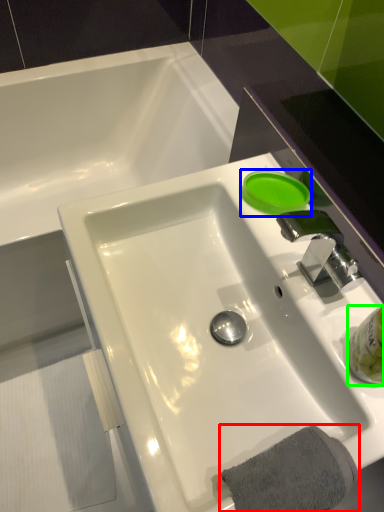
Question: Which is nearer to the bath towel (highlighted by a red box)? liquid (highlighted by a blue box) or liquid (highlighted by a green box).

Choices:
 (A) liquid
 (B) liquid

Answer: (B)